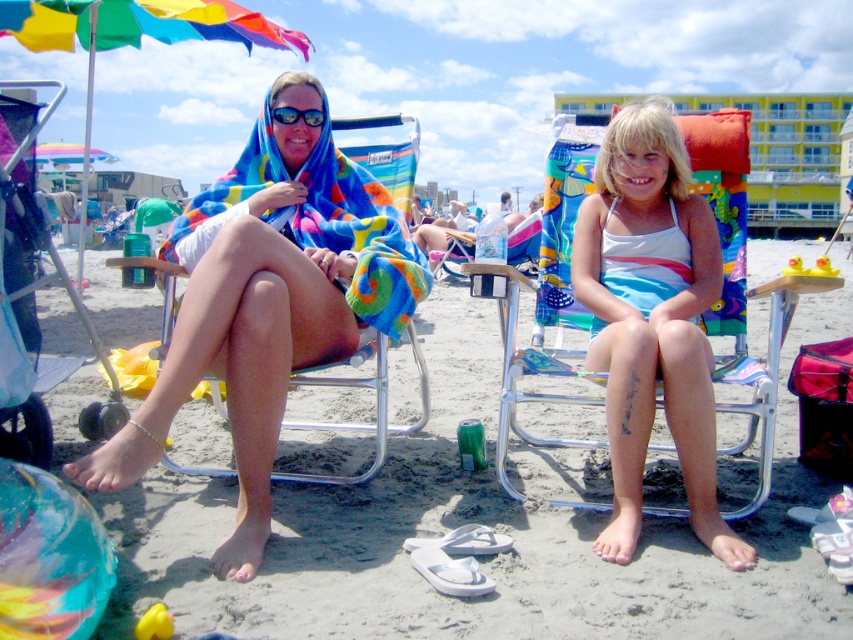
Question: Is the position of metallic silver beach chair at left less distant than that of matte black goggles at center?

Choices:
 (A) no
 (B) yes

Answer: (B)

Question: Observing the image, what is the correct spatial positioning of multicolored towel at left in reference to matte black goggles at center?

Choices:
 (A) above
 (B) below

Answer: (B)

Question: Estimate the real-world distances between objects in this image. Which object is closer to the matte black goggles at center?

Choices:
 (A) multicolored towel at center
 (B) white satin dress at center

Answer: (A)

Question: Is metallic silver beach chair at left positioned in front of multicolored towel at left?

Choices:
 (A) yes
 (B) no

Answer: (A)

Question: Which object is the closest to the multicolored towel at left?

Choices:
 (A) matte black goggles at center
 (B) metallic silver beach chair at left
 (C) white satin dress at center

Answer: (A)

Question: Which point appears farthest from the camera in this image?

Choices:
 (A) (338, 188)
 (B) (39, 394)
 (C) (717, 230)

Answer: (A)